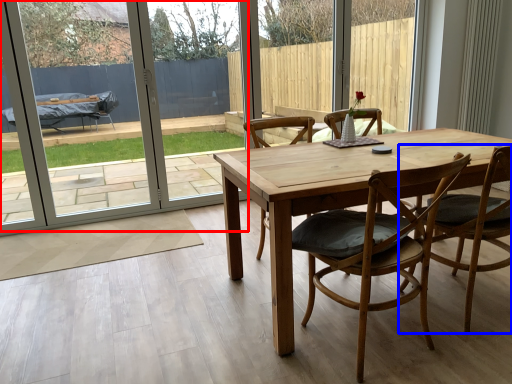
Question: Among these objects, which one is farthest to the camera, screen door (highlighted by a red box) or chair (highlighted by a blue box)?

Choices:
 (A) screen door
 (B) chair

Answer: (A)